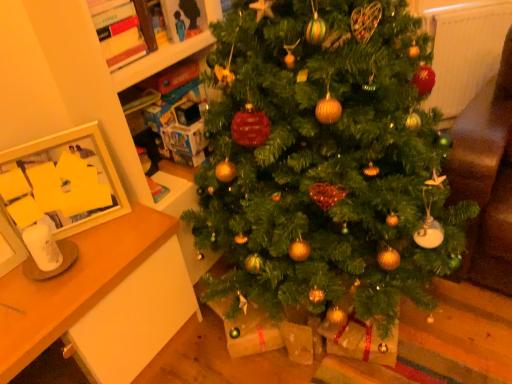
Question: Is wooden desk at left not inside green matte christmas tree at center?

Choices:
 (A) no
 (B) yes

Answer: (B)

Question: Considering the relative positions of wooden desk at left and green matte christmas tree at center in the image provided, is wooden desk at left in front of green matte christmas tree at center?

Choices:
 (A) no
 (B) yes

Answer: (A)

Question: Does wooden desk at left have a lesser width compared to green matte christmas tree at center?

Choices:
 (A) yes
 (B) no

Answer: (A)

Question: From a real-world perspective, is wooden desk at left below green matte christmas tree at center?

Choices:
 (A) yes
 (B) no

Answer: (A)

Question: Is wooden desk at left looking in the opposite direction of green matte christmas tree at center?

Choices:
 (A) yes
 (B) no

Answer: (B)

Question: Is wooden desk at left bigger than green matte christmas tree at center?

Choices:
 (A) yes
 (B) no

Answer: (B)

Question: Does white glossy picture frame at left lie behind wooden desk at left?

Choices:
 (A) yes
 (B) no

Answer: (A)

Question: Is white glossy picture frame at left next to wooden desk at left?

Choices:
 (A) yes
 (B) no

Answer: (B)

Question: Could you tell me if white glossy picture frame at left is turned towards wooden desk at left?

Choices:
 (A) no
 (B) yes

Answer: (A)

Question: Considering the relative sizes of white glossy picture frame at left and wooden desk at left in the image provided, is white glossy picture frame at left bigger than wooden desk at left?

Choices:
 (A) yes
 (B) no

Answer: (B)

Question: From a real-world perspective, is white glossy picture frame at left on top of wooden desk at left?

Choices:
 (A) yes
 (B) no

Answer: (A)

Question: Could wooden desk at left be considered to be inside white glossy picture frame at left?

Choices:
 (A) no
 (B) yes

Answer: (A)

Question: Does white glossy picture frame at left have a lesser height compared to green matte christmas tree at center?

Choices:
 (A) yes
 (B) no

Answer: (A)